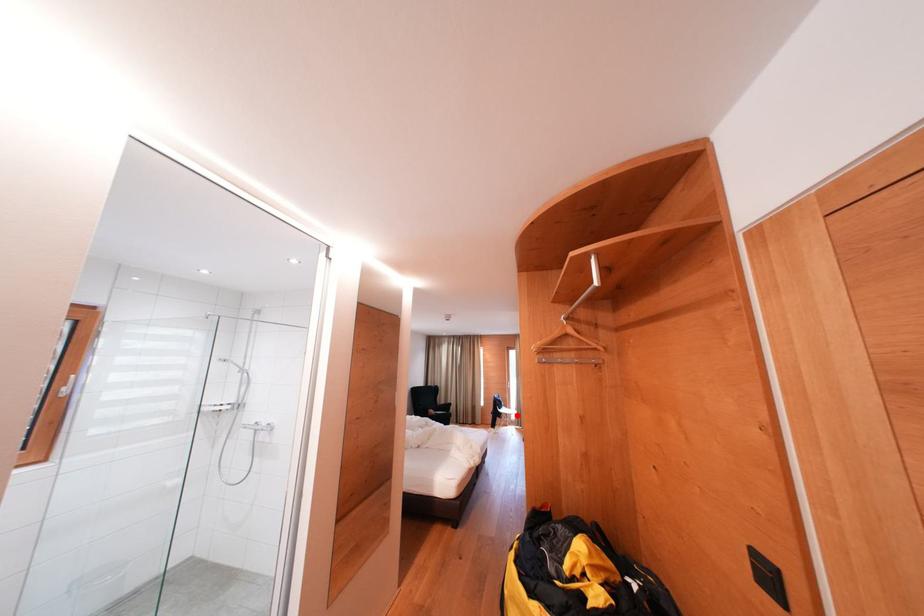
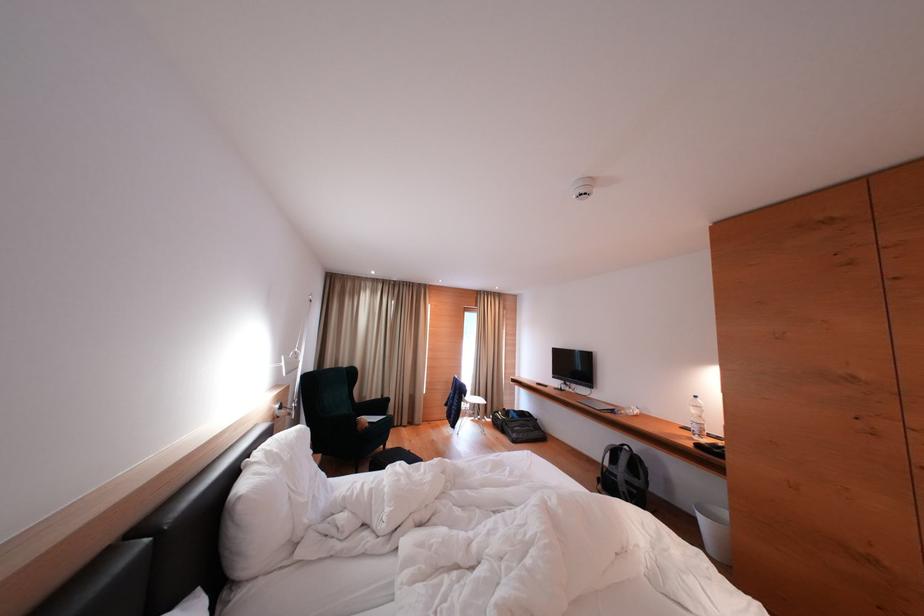
In the second image, find the point that corresponds to the highlighted location in the first image.

(477, 402)